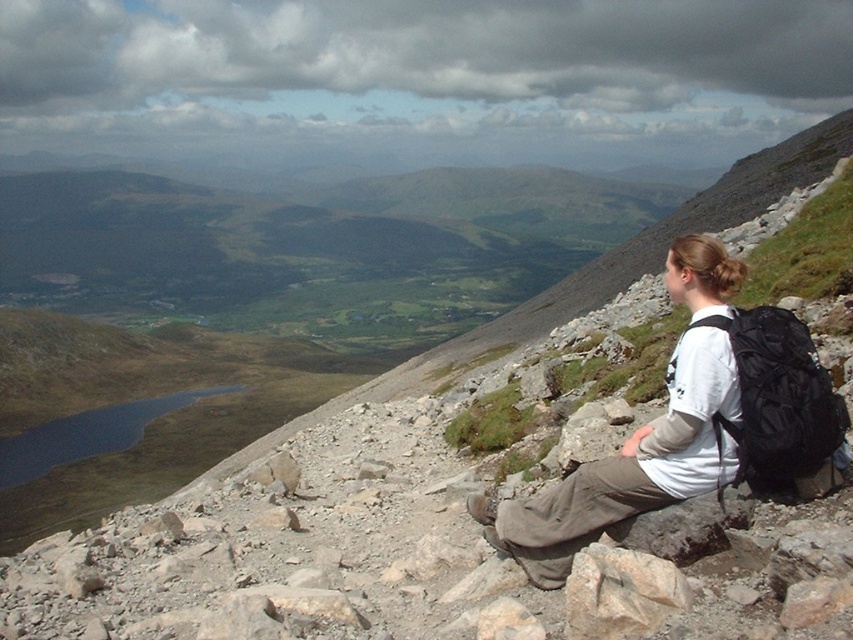
You are a photographer trying to capture the person sitting on the slope. The camera you have can only focus on objects wider than 1 meter. Based on the scene, can you determine if the white cotton shirt at center will be in focus if the camera is set to focus on the rough textured rock at lower right?

The white cotton shirt at center might be wider than rough textured rock at lower right. If the camera focuses on the rough textured rock at lower right and the shirt is wider, it could still be in focus depending on the depth of field. However, without knowing the exact distance and aperture settings, it is uncertain. The description only mentions width comparison, not distance from the camera.